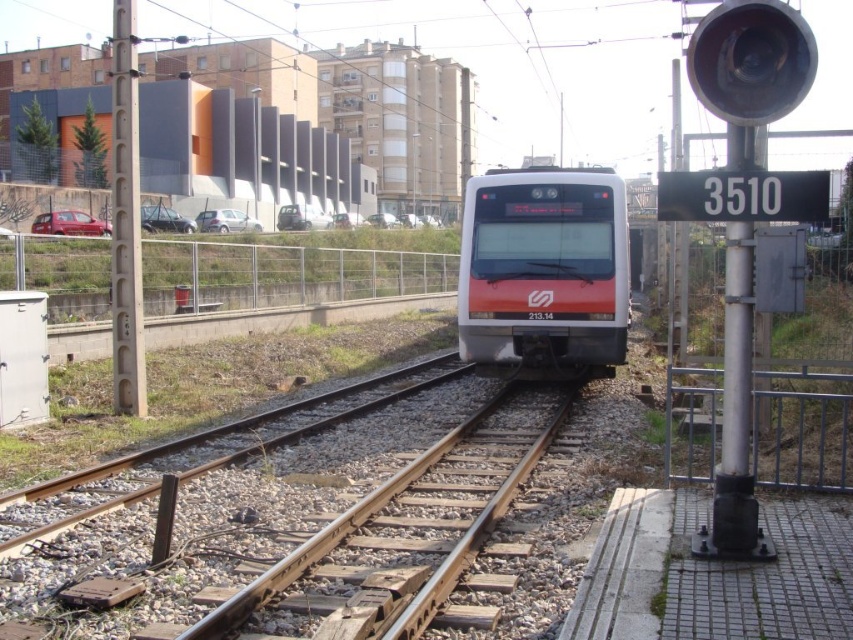
Between point (241, 593) and point (602, 332), which one is positioned in front?

Positioned in front is point (241, 593).

Can you confirm if rusty metal train track at center is thinner than white glossy passenger train at center?

Yes, rusty metal train track at center is thinner than white glossy passenger train at center.

Does point (469, 497) come farther from viewer compared to point (560, 189)?

No, (469, 497) is closer to viewer.

Find the location of `rusty metal train track at center`. rusty metal train track at center is located at coordinates (407, 538).

Does white glossy passenger train at center have a greater width compared to smooth gray pole at left?

No.

Is white glossy passenger train at center closer to camera compared to smooth gray pole at left?

No, white glossy passenger train at center is further to the viewer.

Between point (543, 172) and point (119, 1), which one is positioned in front?

Positioned in front is point (119, 1).

The width and height of the screenshot is (853, 640). I want to click on white glossy passenger train at center, so click(544, 268).

Does rusty metal train track at center have a smaller size compared to smooth gray pole at left?

Yes.

Describe the element at coordinates (407, 538) in the screenshot. I see `rusty metal train track at center` at that location.

The width and height of the screenshot is (853, 640). What do you see at coordinates (407, 538) in the screenshot?
I see `rusty metal train track at center` at bounding box center [407, 538].

At what (x,y) coordinates should I click in order to perform the action: click on rusty metal train track at center. Please return your answer as a coordinate pair (x, y). The width and height of the screenshot is (853, 640). Looking at the image, I should click on (407, 538).